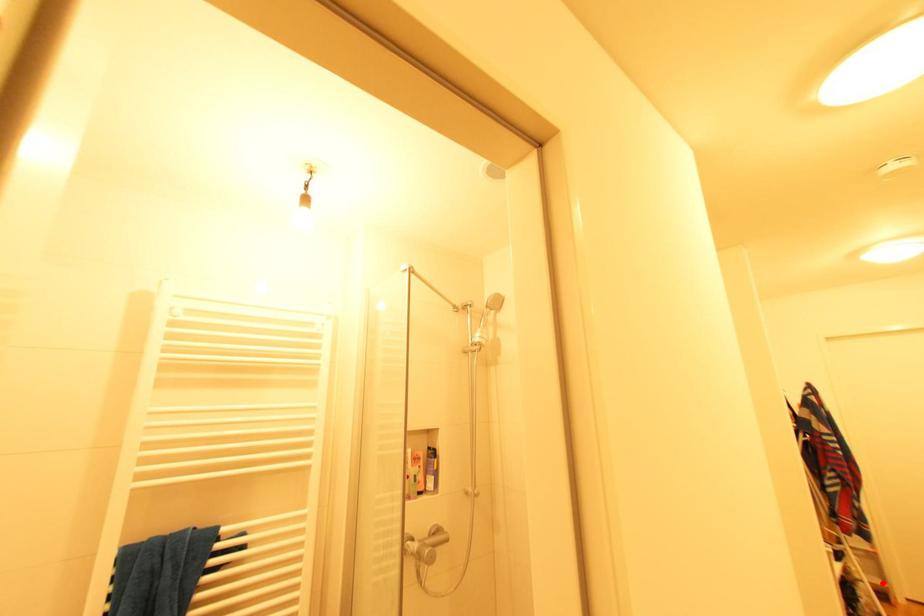
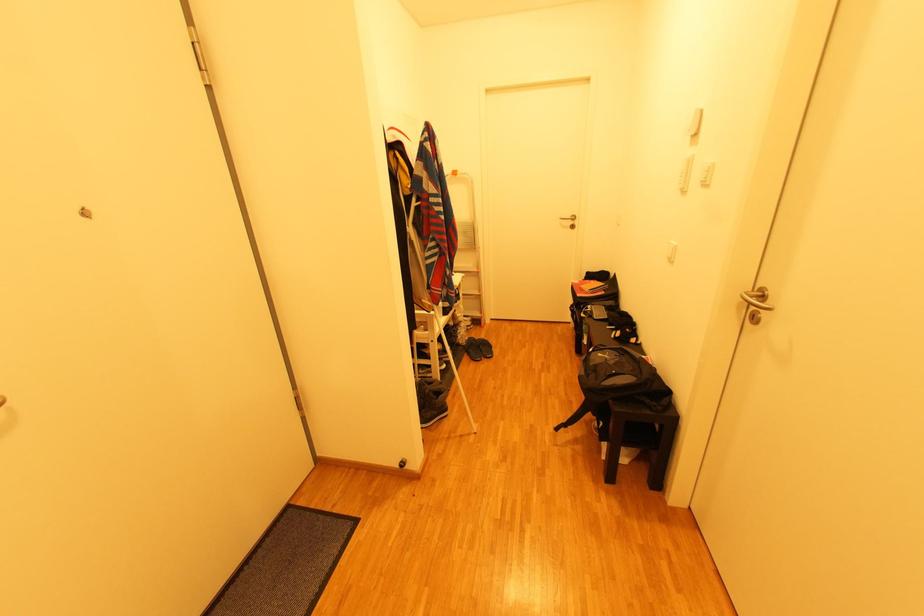
Question: I am providing you with two images of the same scene from different viewpoints. In image1, a red point is highlighted. Considering the same 3D point in image2, which of the following is correct?

Choices:
 (A) It is closer
 (B) It is farther

Answer: (A)